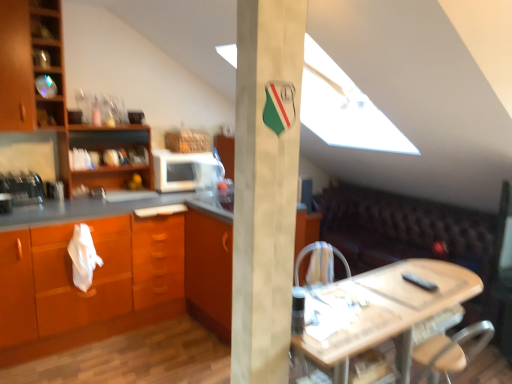
Question: Is the depth of wooden shelves at left greater than that of orange wood cabinet at left, the first cabinetry ordered from the bottom?

Choices:
 (A) yes
 (B) no

Answer: (A)

Question: Can you confirm if wooden shelves at left is taller than orange wood cabinet at left, placed as the 2th cabinetry when sorted from left to right?

Choices:
 (A) no
 (B) yes

Answer: (A)

Question: From the image's perspective, is wooden shelves at left over orange wood cabinet at left, placed as the 2th cabinetry when sorted from left to right?

Choices:
 (A) no
 (B) yes

Answer: (B)

Question: Are wooden shelves at left and orange wood cabinet at left, positioned as the second cabinetry in top-to-bottom order, making contact?

Choices:
 (A) yes
 (B) no

Answer: (B)

Question: Is orange wood cabinet at left, which is the 1th cabinetry from right to left, at the back of wooden shelves at left?

Choices:
 (A) no
 (B) yes

Answer: (A)

Question: Is wooden shelves at left situated inside white matte pillar at center or outside?

Choices:
 (A) inside
 (B) outside

Answer: (B)

Question: Considering the positions of point (82, 135) and point (240, 264), is point (82, 135) closer or farther from the camera than point (240, 264)?

Choices:
 (A) closer
 (B) farther

Answer: (B)

Question: From the image's perspective, is wooden shelves at left above or below white matte pillar at center?

Choices:
 (A) below
 (B) above

Answer: (B)

Question: From their relative heights in the image, would you say wooden shelves at left is taller or shorter than white matte pillar at center?

Choices:
 (A) short
 (B) tall

Answer: (A)

Question: From a real-world perspective, is matte wood countertop at left above or below white matte pillar at center?

Choices:
 (A) below
 (B) above

Answer: (A)

Question: From the image's perspective, is matte wood countertop at left above or below white matte pillar at center?

Choices:
 (A) below
 (B) above

Answer: (A)

Question: Considering the positions of matte wood countertop at left and white matte pillar at center in the image, is matte wood countertop at left taller or shorter than white matte pillar at center?

Choices:
 (A) tall
 (B) short

Answer: (B)

Question: Visually, is matte wood countertop at left positioned to the left or to the right of white matte pillar at center?

Choices:
 (A) right
 (B) left

Answer: (B)

Question: Considering the positions of white matte pillar at center and wooden cabinet at left, which appears as the second cabinetry when ordered from the bottom, in the image, is white matte pillar at center taller or shorter than wooden cabinet at left, which appears as the second cabinetry when ordered from the bottom,?

Choices:
 (A) tall
 (B) short

Answer: (A)

Question: Is white matte pillar at center wider or thinner than wooden cabinet at left, the 1th cabinetry from the top?

Choices:
 (A) wide
 (B) thin

Answer: (B)